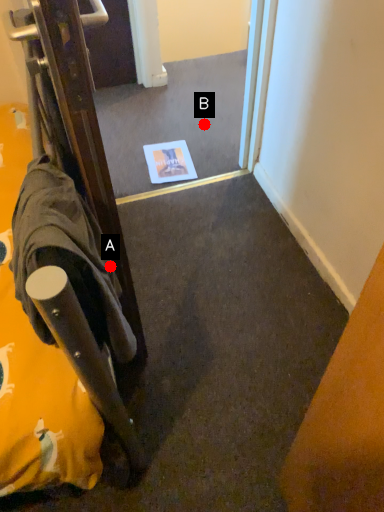
Question: Two points are circled on the image, labeled by A and B beside each circle. Which point is closer to the camera taking this photo?

Choices:
 (A) A is closer
 (B) B is closer

Answer: (A)